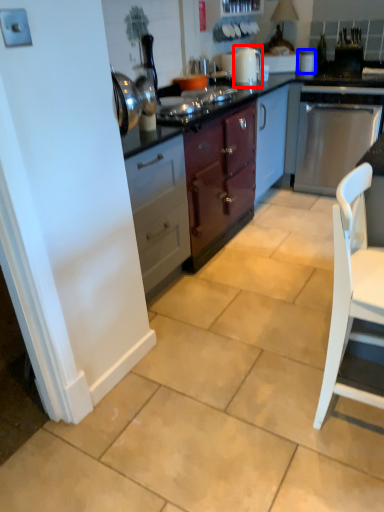
Question: Which point is further to the camera, kitchen appliance (highlighted by a red box) or appliance (highlighted by a blue box)?

Choices:
 (A) kitchen appliance
 (B) appliance

Answer: (B)